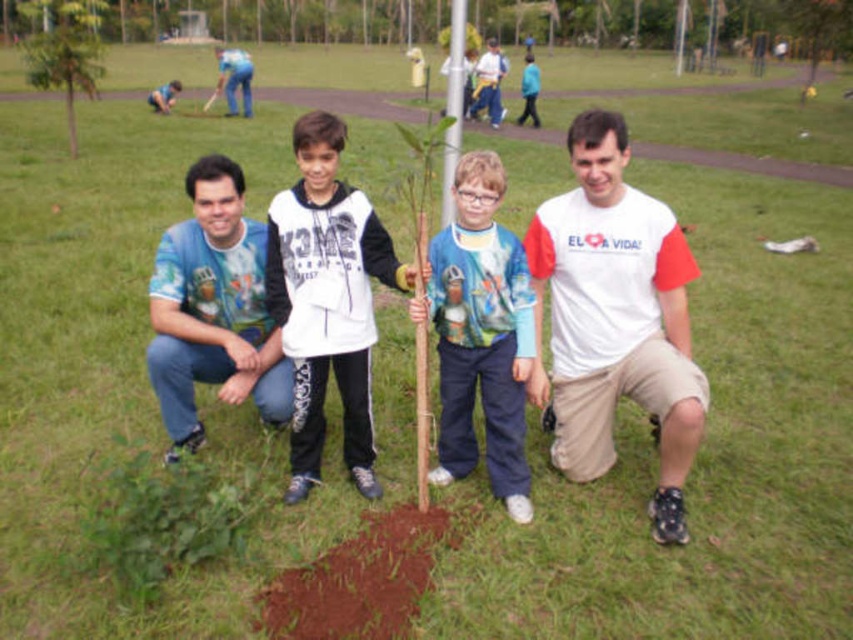
Who is shorter, white cotton t-shirt at center or white matte shirt at center?

white matte shirt at center

Which is more to the right, white cotton t-shirt at center or white matte shirt at center?

From the viewer's perspective, white cotton t-shirt at center appears more on the right side.

Does point (657, 268) come farther from viewer compared to point (340, 326)?

That is True.

Where is `white cotton t-shirt at center`? This screenshot has height=640, width=853. white cotton t-shirt at center is located at coordinates (614, 317).

Which is behind, point (498, 294) or point (248, 67)?

The point (248, 67) is more distant.

The height and width of the screenshot is (640, 853). I want to click on blue cotton shirt at center, so click(x=480, y=333).

Which is in front, point (467, 248) or point (238, 61)?

Positioned in front is point (467, 248).

This screenshot has width=853, height=640. What are the coordinates of `blue cotton shirt at center` in the screenshot? It's located at (480, 333).

The height and width of the screenshot is (640, 853). What do you see at coordinates (614, 317) in the screenshot?
I see `white cotton t-shirt at center` at bounding box center [614, 317].

Who is more distant from viewer, (677, 326) or (495, 49)?

The point (495, 49) is more distant.

Image resolution: width=853 pixels, height=640 pixels. Describe the element at coordinates (614, 317) in the screenshot. I see `white cotton t-shirt at center` at that location.

This screenshot has width=853, height=640. In order to click on white cotton t-shirt at center in this screenshot , I will do `click(614, 317)`.